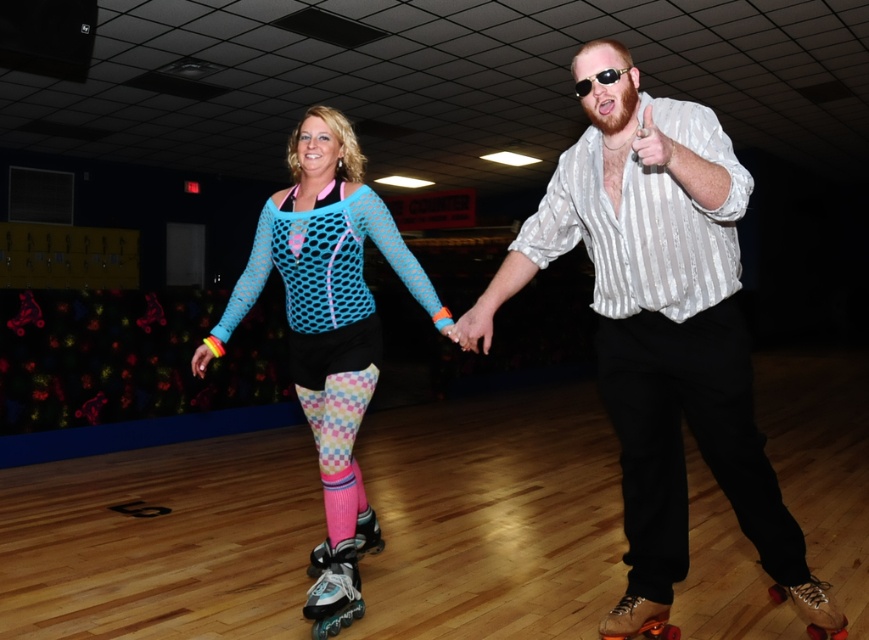
Question: Is shiny brown leather roller skates at lower right bigger than pink mesh roller skates at center?

Choices:
 (A) yes
 (B) no

Answer: (B)

Question: Among these points, which one is nearest to the camera?

Choices:
 (A) (316, 557)
 (B) (634, 608)
 (C) (618, 268)
 (D) (346, 132)

Answer: (C)

Question: Which object appears farthest from the camera in this image?

Choices:
 (A) neon blue mesh top at center
 (B) shiny silver roller skates at center
 (C) shiny brown leather roller skates at lower right
 (D) brown leather roller skates at lower center

Answer: (B)

Question: Is silver striped shirt at center wider than black cotton pants at right?

Choices:
 (A) no
 (B) yes

Answer: (B)

Question: Estimate the real-world distances between objects in this image. Which object is farther from the brown leather roller skates at lower center?

Choices:
 (A) shiny silver roller skates at center
 (B) black cotton pants at right
 (C) silver striped shirt at center
 (D) shiny brown leather roller skates at lower right

Answer: (A)

Question: From the image, what is the correct spatial relationship of neon blue mesh top at center in relation to shiny brown leather roller skates at lower right?

Choices:
 (A) right
 (B) left

Answer: (B)